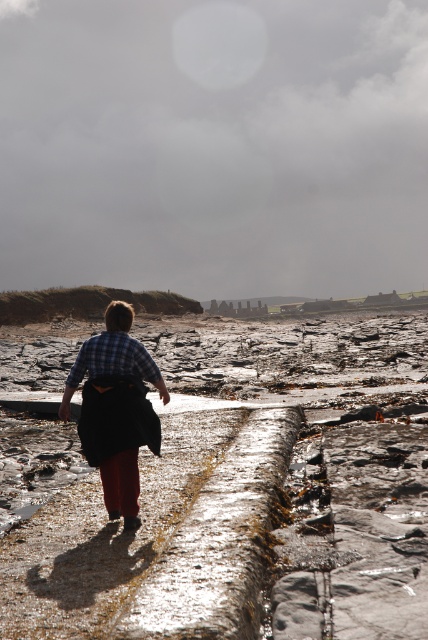
Question: Does smooth stone path at center have a smaller size compared to plaid fabric shirt at center?

Choices:
 (A) yes
 (B) no

Answer: (B)

Question: Which object appears farthest from the camera in this image?

Choices:
 (A) plaid fabric shirt at center
 (B) smooth stone path at center

Answer: (A)

Question: Can you confirm if smooth stone path at center is positioned above plaid fabric shirt at center?

Choices:
 (A) no
 (B) yes

Answer: (A)

Question: Is smooth stone path at center wider than plaid fabric shirt at center?

Choices:
 (A) no
 (B) yes

Answer: (B)